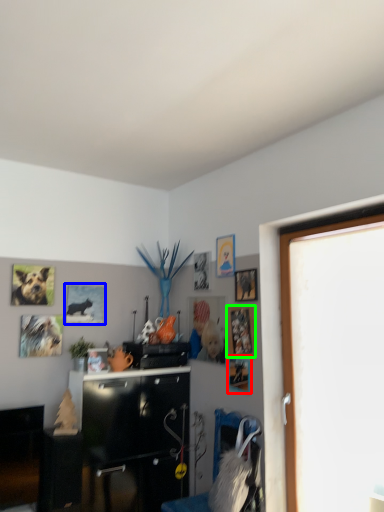
Question: Which is nearer to the picture frame (highlighted by a red box)? picture frame (highlighted by a blue box) or picture frame (highlighted by a green box).

Choices:
 (A) picture frame
 (B) picture frame

Answer: (B)